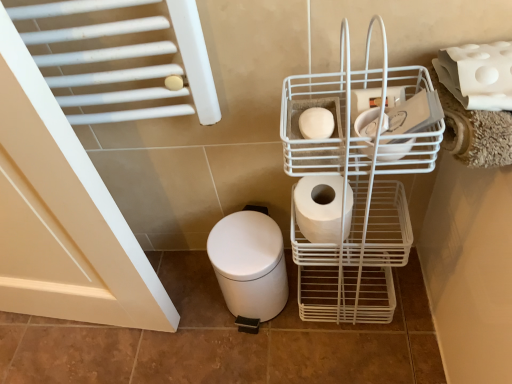
Question: In terms of width, does white matte toilet paper at center right, the third toilet paper from the left, look wider or thinner when compared to white matte toilet bowl at lower left?

Choices:
 (A) thin
 (B) wide

Answer: (A)

Question: Does point (376, 124) appear closer or farther from the camera than point (230, 238)?

Choices:
 (A) closer
 (B) farther

Answer: (A)

Question: Which object is the closest to the white matte toilet paper at center right, the third toilet paper from the left?

Choices:
 (A) white wire basket at center right
 (B) white matte toilet paper at upper right, the 4th toilet paper in the left-to-right sequence
 (C) white matte toilet paper at center-right, marked as the third toilet paper in a right-to-left arrangement
 (D) white matte toilet paper at center, the first toilet paper in the left-to-right sequence
 (E) white matte toilet bowl at lower left

Answer: (B)

Question: Which object is positioned closest to the white matte toilet bowl at lower left?

Choices:
 (A) white matte toilet paper at center, positioned as the fourth toilet paper in right-to-left order
 (B) white matte toilet paper at upper right, the 4th toilet paper in the left-to-right sequence
 (C) white matte toilet paper at center-right, the second toilet paper when ordered from left to right
 (D) white matte toilet paper at center right, the third toilet paper from the left
 (E) white wire basket at center right

Answer: (C)